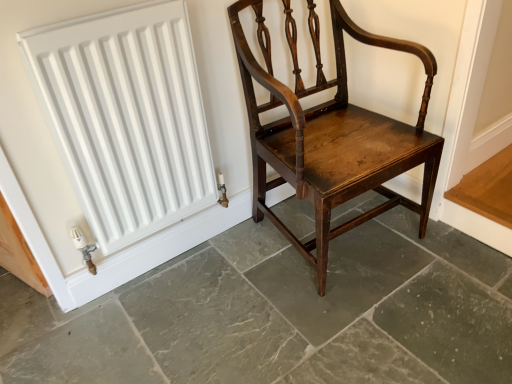
At what (x,y) coordinates should I click in order to perform the action: click on vacant space underneath white matte radiator at upper left (from a real-world perspective). Please return your answer as a coordinate pair (x, y). The height and width of the screenshot is (384, 512). Looking at the image, I should click on (155, 264).